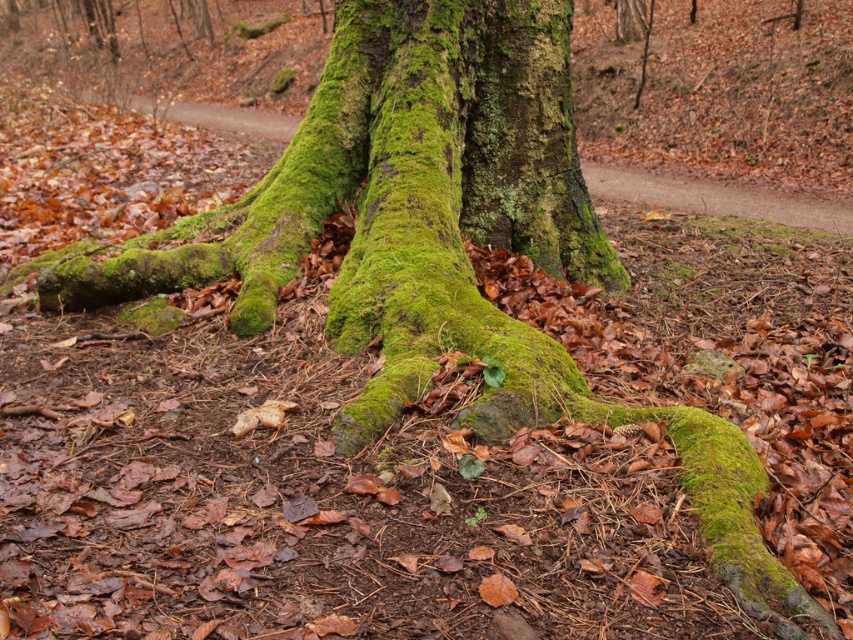
Is point (521, 35) farther from viewer compared to point (692, 198)?

That is False.

Describe the element at coordinates (527, 141) in the screenshot. I see `green mossy bark at center` at that location.

You are a GUI agent. You are given a task and a screenshot of the screen. Output one action in this format:
    pyautogui.click(x=<x>, y=<y>)
    Task: Click on the green mossy bark at center
    This screenshot has height=640, width=853.
    Given the screenshot: What is the action you would take?
    pyautogui.click(x=527, y=141)